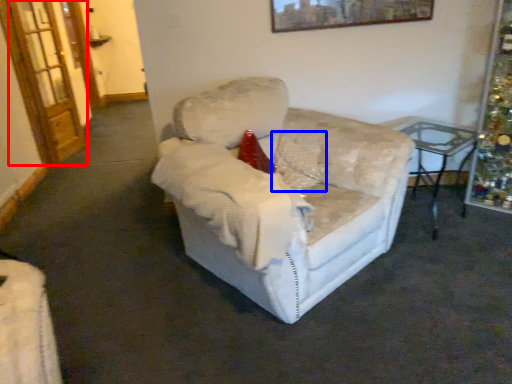
Question: Which point is further to the camera, glass door (highlighted by a red box) or pillow (highlighted by a blue box)?

Choices:
 (A) glass door
 (B) pillow

Answer: (A)